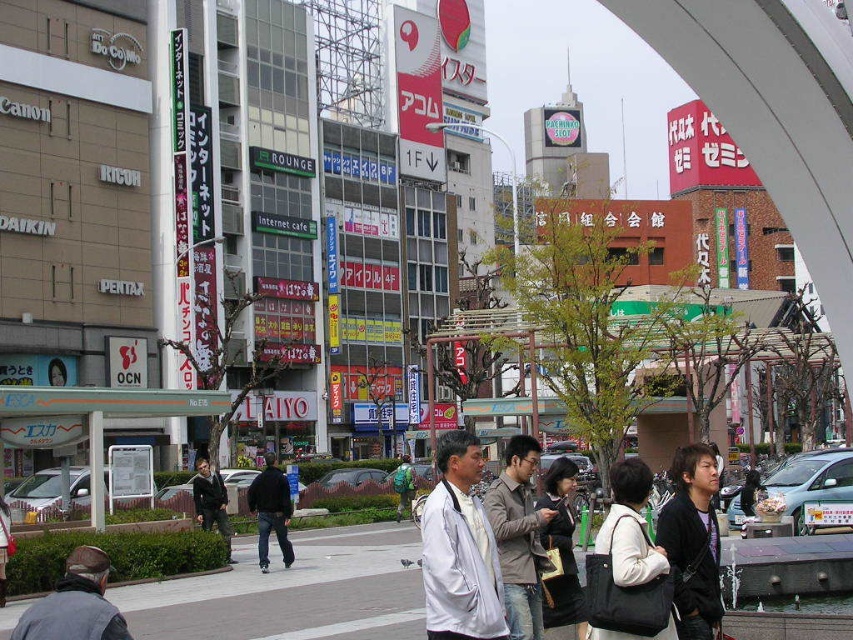
Question: Is gray fabric jacket at lower left below black fabric bag at center?

Choices:
 (A) yes
 (B) no

Answer: (A)

Question: Is dark blue jeans at center thinner than dark gray jacket at center?

Choices:
 (A) no
 (B) yes

Answer: (B)

Question: Estimate the real-world distances between objects in this image. Which object is closer to the light brown leather jacket at center?

Choices:
 (A) dark blue jeans at center
 (B) dark brown leather jacket at center
 (C) gray fabric jacket at lower left
 (D) dark gray jacket at center

Answer: (B)

Question: Among these points, which one is farthest from the camera?

Choices:
 (A) (447, 602)
 (B) (495, 525)

Answer: (B)

Question: Which point is closer to the camera?

Choices:
 (A) green backpack at center
 (B) dark blue jeans at center
 (C) white matte jacket at center

Answer: (C)

Question: Observing the image, what is the correct spatial positioning of white matte jacket at center in reference to dark brown leather jacket at center?

Choices:
 (A) below
 (B) above

Answer: (A)